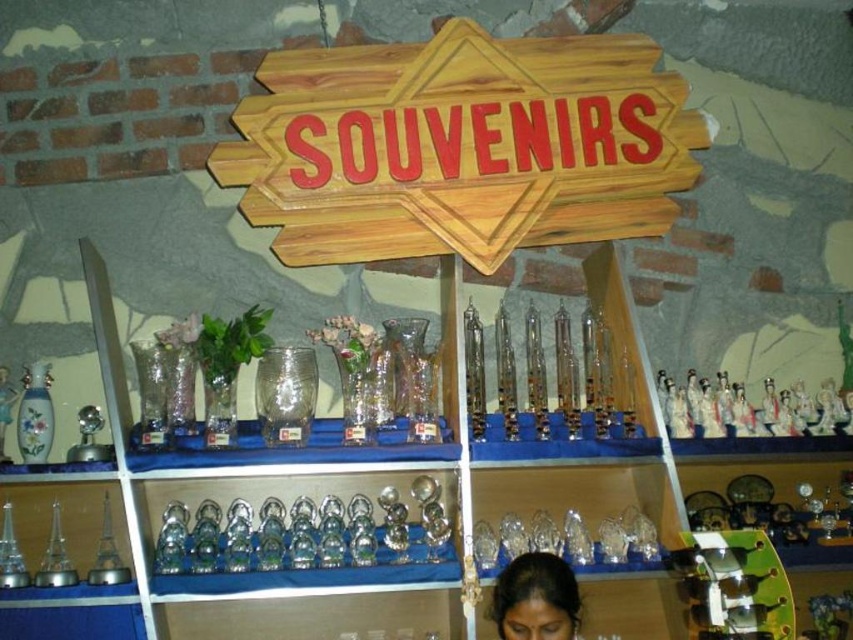
Question: Which point appears farthest from the camera in this image?

Choices:
 (A) tap(546, 616)
 (B) tap(306, 179)

Answer: (B)

Question: Is wooden sign at upper center above black hair at lower center?

Choices:
 (A) no
 (B) yes

Answer: (B)

Question: Is wooden sign at upper center to the right of black hair at lower center from the viewer's perspective?

Choices:
 (A) no
 (B) yes

Answer: (A)

Question: Which of the following is the farthest from the observer?

Choices:
 (A) (434, 113)
 (B) (512, 637)

Answer: (A)

Question: Is wooden sign at upper center positioned behind black hair at lower center?

Choices:
 (A) yes
 (B) no

Answer: (A)